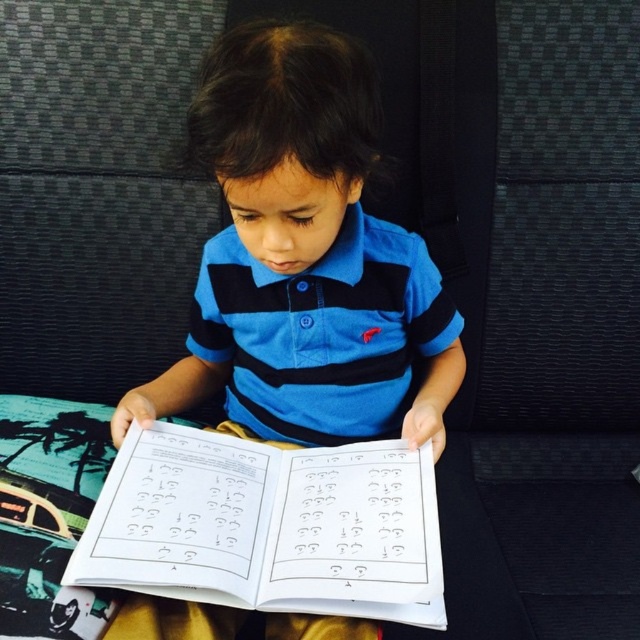
You are a tailor who needs to determine which item to use for a client who requires a larger garment. Looking at the image, which of the two items is larger between the blue striped shirt at center and the blue striped polo shirt at center?

The blue striped shirt at center is bigger than the blue striped polo shirt at center, so the tailor should choose the blue striped shirt at center for the client needing a larger garment.

You are a photographer taking a photo of the child and the book. You want to ensure that the point at point [212,104] is in focus. What is the minimum distance you need to set your camera focus to capture this point clearly?

The point at point [212,104] is 27.29 inches from the camera, so you need to set the camera focus to at least 27.29 inches to capture it clearly.